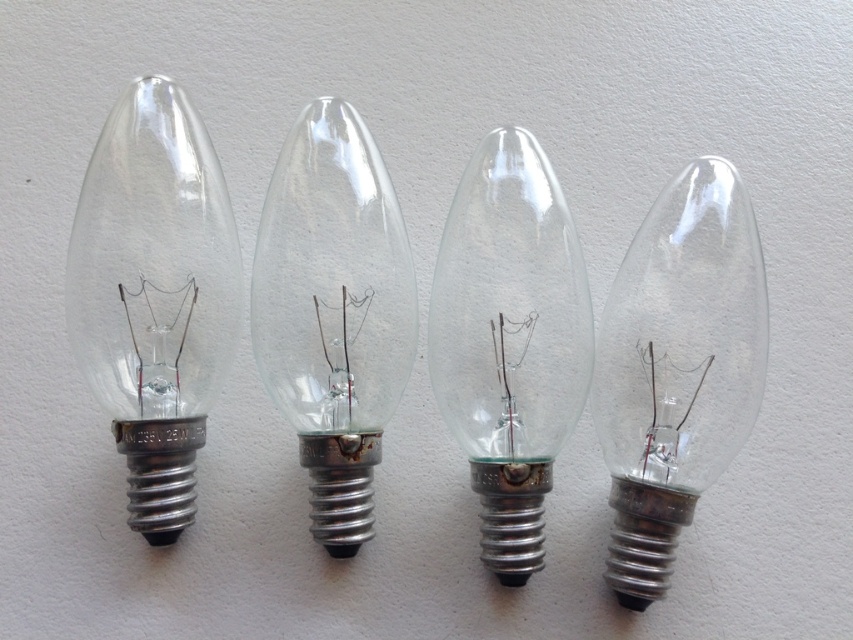
You are holding a camera and want to take a closeup photo of the transparent glass light bulb at left. The camera requires a minimum distance of 1.5 meters to focus properly. Can you take a clear photo without moving closer?

The transparent glass light bulb at left and camera are 1.34 meters apart from each other, which is less than the required 1.5 meters. Therefore, you cannot take a clear photo without moving closer.

You are an electrician trying to install a new bulb. You have two bulbs available in your toolkit. One is the transparent glass light bulb at center and the other is the clear glass bulb at center. Which bulb should you choose if you need to fit it into a narrow socket without any obstruction?

You should choose the transparent glass light bulb at center because it occupies less space than the clear glass bulb at center, making it easier to fit into a narrow socket without obstruction.

You are standing 5 feet away from the image. Is the point at coordinates point (695, 296) closer to you than the viewer?

The point (695, 296) and viewer are 4.42 feet apart, so the point is closer to you than the viewer since you are standing 5 feet away.